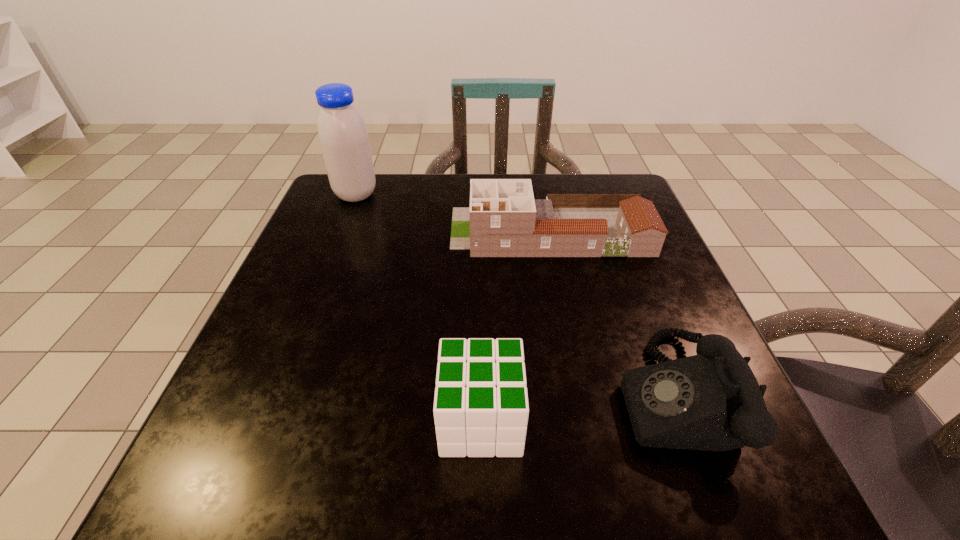
This screenshot has width=960, height=540. What are the coordinates of `object at the left edge` in the screenshot? It's located at (343, 136).

I want to click on dollhouse positioned at the right edge, so click(x=503, y=220).

Where is `telephone that is at the right edge`? The width and height of the screenshot is (960, 540). telephone that is at the right edge is located at coordinates (712, 401).

You are a GUI agent. You are given a task and a screenshot of the screen. Output one action in this format:
    pyautogui.click(x=<x>, y=<y>)
    Task: Click on the object situated at the far left corner
    This screenshot has width=960, height=540.
    Given the screenshot: What is the action you would take?
    pyautogui.click(x=343, y=136)

In order to click on object present at the far right corner in this screenshot , I will do `click(503, 220)`.

This screenshot has height=540, width=960. In order to click on object situated at the near right corner in this screenshot , I will do `click(712, 401)`.

Identify the location of vacant space at the far edge of the desktop. The height and width of the screenshot is (540, 960). (390, 191).

This screenshot has width=960, height=540. In order to click on vacant space at the left edge in this screenshot , I will do `click(357, 250)`.

In the image, there is a desktop. Find the location of `vacant space at the right edge`. vacant space at the right edge is located at coordinates (648, 322).

Image resolution: width=960 pixels, height=540 pixels. What are the coordinates of `vacant space at the far left corner of the desktop` in the screenshot? It's located at (321, 197).